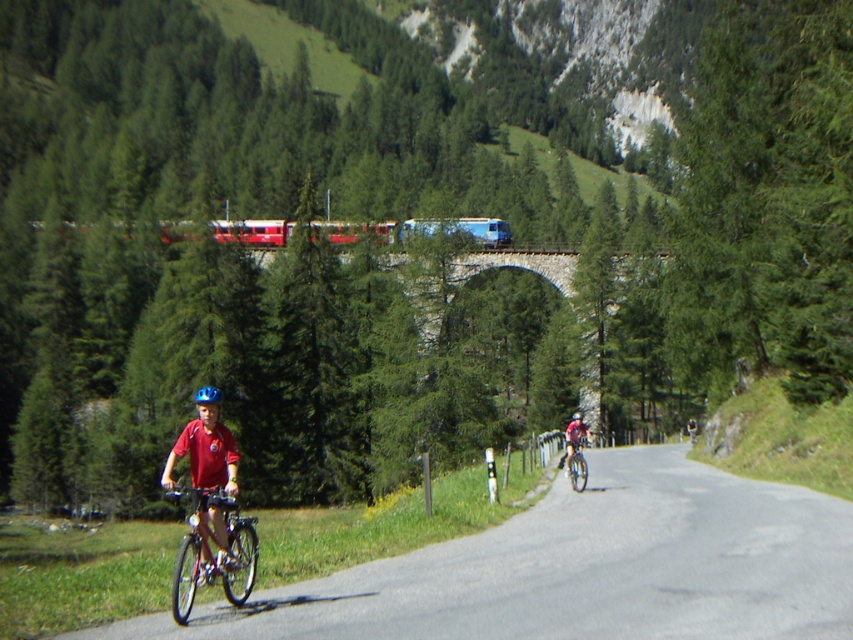
Question: Which point is closer to the camera?

Choices:
 (A) blue matte helmet at center
 (B) red matte train at center

Answer: (A)

Question: Among these points, which one is farthest from the camera?

Choices:
 (A) (566, 467)
 (B) (508, 612)
 (C) (186, 234)
 (D) (206, 396)

Answer: (C)

Question: Can you confirm if red matte train at center is smaller than shiny metallic bicycle at center?

Choices:
 (A) yes
 (B) no

Answer: (B)

Question: Is red matte train at center bigger than shiny metallic bicycle at center?

Choices:
 (A) no
 (B) yes

Answer: (B)

Question: Can you confirm if smooth asphalt road at center is wider than blue matte helmet at center?

Choices:
 (A) no
 (B) yes

Answer: (B)

Question: Estimate the real-world distances between objects in this image. Which object is farther from the shiny metallic bicycle at center?

Choices:
 (A) smooth asphalt road at center
 (B) red matte train at center
 (C) blue matte helmet at center
 (D) shiny metallic bicycle at left

Answer: (B)